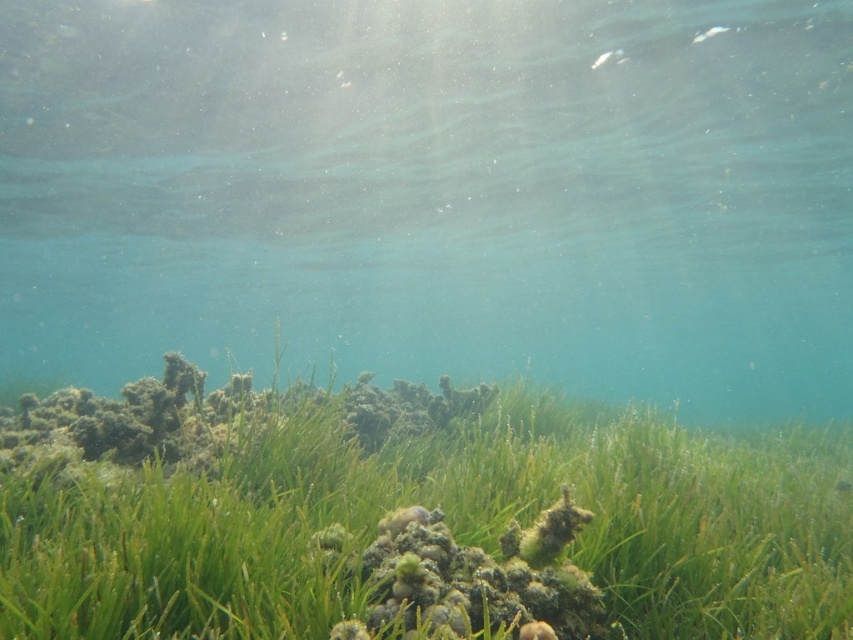
You are a marine biologist observing this underwater scene. You need to determine which object occupies a larger area in the image. Based on the scene, which one is bigger between the clear water at bottom and the green matte grass at center?

The clear water at bottom has a larger size compared to the green matte grass at center, so the clear water at bottom is bigger.

You are a scuba diver with a 30 feet air supply remaining. You are currently looking at the clear water at bottom. Can you safely ascend to the surface without needing to refill your air?

The distance between the clear water at bottom and the camera is 33.06 feet. Since you have 30 feet of air remaining, you do not have enough air to safely ascend the 33.06 feet distance to the surface. You should find a way to reduce your air consumption or find additional air supply before ascending.

You are a scuba diver who wants to take a photo of the clear water at bottom. According to the coordinates provided, where should you aim your camera?

The clear water at bottom is located at coordinates point (436, 192), so aim your camera there.